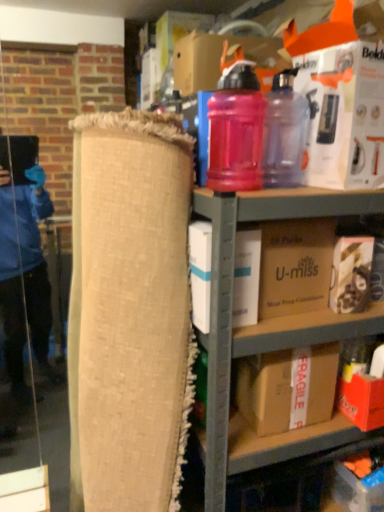
Locate an element on the screen. This screenshot has width=384, height=512. white cardboard box at upper right, the 5th box from the bottom is located at coordinates (344, 115).

Describe the element at coordinates (295, 266) in the screenshot. I see `brown cardboard box at center, which ranks as the 2th box in top-to-bottom order` at that location.

At what (x,y) coordinates should I click in order to perform the action: click on fragile cardboard box at lower right. Please return your answer as a coordinate pair (x, y). Image resolution: width=384 pixels, height=512 pixels. Looking at the image, I should click on (358, 489).

Locate an element on the screen. burlap roll at center is located at coordinates (129, 311).

This screenshot has height=512, width=384. Identify the location of fragile cardboard box at center, which ranks as the first box in bottom-to-top order. (287, 388).

The width and height of the screenshot is (384, 512). Identify the location of white cardboard box at upper right, the 5th box from the bottom. (344, 115).

Is matte plastic shelf at upper center facing away from fragile cardboard box at center, the fifth box in the top-to-bottom sequence?

Yes, matte plastic shelf at upper center is positioned with its back facing fragile cardboard box at center, the fifth box in the top-to-bottom sequence.

Is matte plastic shelf at upper center inside or outside of fragile cardboard box at center, which ranks as the first box in bottom-to-top order?

The correct answer is: outside.

Based on the photo, from a real-world perspective, is matte plastic shelf at upper center positioned over fragile cardboard box at center, which ranks as the first box in bottom-to-top order, based on gravity?

Incorrect, from a real-world perspective, matte plastic shelf at upper center is lower than fragile cardboard box at center, which ranks as the first box in bottom-to-top order.

From their relative heights in the image, would you say pink translucent bottle at upper center, placed as the second bottle when sorted from right to left, is taller or shorter than white cardboard box at center, which is the fourth box in top-to-bottom order?

In the image, pink translucent bottle at upper center, placed as the second bottle when sorted from right to left, appears to be taller than white cardboard box at center, which is the fourth box in top-to-bottom order.

Can you tell me how much pink translucent bottle at upper center, which appears as the first bottle when viewed from the left, and white cardboard box at center, acting as the second box starting from the bottom, differ in facing direction?

They differ by 3.09 degrees in their facing directions.

From the image's perspective, is pink translucent bottle at upper center, which appears as the first bottle when viewed from the left, over white cardboard box at center, acting as the second box starting from the bottom?

Yes.

Could you measure the distance between pink translucent bottle at upper center, placed as the second bottle when sorted from right to left, and white cardboard box at center, which is the fourth box in top-to-bottom order?

The distance of pink translucent bottle at upper center, placed as the second bottle when sorted from right to left, from white cardboard box at center, which is the fourth box in top-to-bottom order, is 22.53 centimeters.

Would you say fragile cardboard box at center, which ranks as the first box in bottom-to-top order, is a long distance from pink translucent water bottle at upper right, which ranks as the second bottle in left-to-right order?

They are positioned close to each other.

From a real-world perspective, is fragile cardboard box at center, the fifth box in the top-to-bottom sequence, under pink translucent water bottle at upper right, which ranks as the second bottle in left-to-right order?

Yes, from a real-world perspective, fragile cardboard box at center, the fifth box in the top-to-bottom sequence, is under pink translucent water bottle at upper right, which ranks as the second bottle in left-to-right order.

Looking at the image, does fragile cardboard box at center, which ranks as the first box in bottom-to-top order, seem bigger or smaller compared to pink translucent water bottle at upper right, which is the first bottle in right-to-left order?

Considering their sizes, fragile cardboard box at center, which ranks as the first box in bottom-to-top order, takes up more space than pink translucent water bottle at upper right, which is the first bottle in right-to-left order.

Is pink translucent water bottle at upper right, which ranks as the second bottle in left-to-right order, surrounded by fragile cardboard box at center, which ranks as the first box in bottom-to-top order?

No, pink translucent water bottle at upper right, which ranks as the second bottle in left-to-right order, is not surrounded by fragile cardboard box at center, which ranks as the first box in bottom-to-top order.

Is fragile cardboard box at lower right at the back of matte plastic shelf at upper center?

Absolutely, matte plastic shelf at upper center is directed away from fragile cardboard box at lower right.

What's the angular difference between matte plastic shelf at upper center and fragile cardboard box at lower right's facing directions?

The facing directions of matte plastic shelf at upper center and fragile cardboard box at lower right are 4.24 degrees apart.

Looking at this image, based on their sizes in the image, would you say matte plastic shelf at upper center is bigger or smaller than fragile cardboard box at lower right?

In the image, matte plastic shelf at upper center appears to be larger than fragile cardboard box at lower right.

Considering the sizes of objects brown cardboard box at center, which ranks as the 2th box in top-to-bottom order, and pink translucent water bottle at upper right, which is the first bottle in right-to-left order, in the image provided, who is smaller, brown cardboard box at center, which ranks as the 2th box in top-to-bottom order, or pink translucent water bottle at upper right, which is the first bottle in right-to-left order,?

pink translucent water bottle at upper right, which is the first bottle in right-to-left order, is smaller.

From the image's perspective, which one is positioned higher, brown cardboard box at center, which ranks as the 4th box in bottom-to-top order, or pink translucent water bottle at upper right, which is the first bottle in right-to-left order?

From the image's view, pink translucent water bottle at upper right, which is the first bottle in right-to-left order, is above.

Does brown cardboard box at center, which ranks as the 4th box in bottom-to-top order, turn towards pink translucent water bottle at upper right, which ranks as the second bottle in left-to-right order?

No, brown cardboard box at center, which ranks as the 4th box in bottom-to-top order, is not turned towards pink translucent water bottle at upper right, which ranks as the second bottle in left-to-right order.

Which is in front, point (307, 307) or point (285, 99)?

The point (285, 99) is closer.

From the image's perspective, which one is positioned higher, brown cardboard box at center, which ranks as the 4th box in bottom-to-top order, or matte brown box at lower right, which is the third box from bottom to top?

brown cardboard box at center, which ranks as the 4th box in bottom-to-top order, from the image's perspective.

Can you confirm if brown cardboard box at center, which ranks as the 2th box in top-to-bottom order, is thinner than matte brown box at lower right, acting as the third box starting from the top?

No, brown cardboard box at center, which ranks as the 2th box in top-to-bottom order, is not thinner than matte brown box at lower right, acting as the third box starting from the top.

Looking at this image, measure the distance between brown cardboard box at center, which ranks as the 2th box in top-to-bottom order, and matte brown box at lower right, acting as the third box starting from the top.

brown cardboard box at center, which ranks as the 2th box in top-to-bottom order, is 3.90 inches from matte brown box at lower right, acting as the third box starting from the top.

Are brown cardboard box at center, which ranks as the 4th box in bottom-to-top order, and matte brown box at lower right, which is the third box from bottom to top, located far from each other?

That's not correct — brown cardboard box at center, which ranks as the 4th box in bottom-to-top order, is a little close to matte brown box at lower right, which is the third box from bottom to top.

Does white cardboard box at upper right, acting as the first box starting from the top, have a greater height compared to matte brown box at lower right, which is the third box from bottom to top?

Correct, white cardboard box at upper right, acting as the first box starting from the top, is much taller as matte brown box at lower right, which is the third box from bottom to top.

What's the angular difference between white cardboard box at upper right, acting as the first box starting from the top, and matte brown box at lower right, which is the third box from bottom to top,'s facing directions?

They differ by 1.6 degrees in their facing directions.

Is matte brown box at lower right, acting as the third box starting from the top, at the back of white cardboard box at upper right, acting as the first box starting from the top?

No, matte brown box at lower right, acting as the third box starting from the top, is not at the back of white cardboard box at upper right, acting as the first box starting from the top.

Is white cardboard box at upper right, acting as the first box starting from the top, wider than matte brown box at lower right, acting as the third box starting from the top?

Yes, white cardboard box at upper right, acting as the first box starting from the top, is wider than matte brown box at lower right, acting as the third box starting from the top.

From a real-world perspective, which box is the 1st one above the matte plastic shelf at upper center? Please provide its 2D coordinates.

[(287, 388)]

The height and width of the screenshot is (512, 384). What are the coordinates of `the 1st bottle to the right of the white cardboard box at center, acting as the second box starting from the bottom, counting from the anchor's position` in the screenshot? It's located at (236, 131).

Estimate the real-world distances between objects in this image. Which object is closer to brown cardboard box at center, which ranks as the 2th box in top-to-bottom order, burlap roll at center or pink translucent water bottle at upper right, which is the first bottle in right-to-left order?

pink translucent water bottle at upper right, which is the first bottle in right-to-left order, is positioned closer to the anchor brown cardboard box at center, which ranks as the 2th box in top-to-bottom order.

Based on their spatial positions, is brown cardboard box at center, which ranks as the 4th box in bottom-to-top order, or white cardboard box at upper right, the 5th box from the bottom, further from fragile cardboard box at center, which ranks as the first box in bottom-to-top order?

The object further to fragile cardboard box at center, which ranks as the first box in bottom-to-top order, is white cardboard box at upper right, the 5th box from the bottom.

Considering their positions, is fragile cardboard box at lower right positioned further to fragile cardboard box at center, which ranks as the first box in bottom-to-top order, than white cardboard box at center, which is the fourth box in top-to-bottom order?

fragile cardboard box at lower right is positioned further to the anchor fragile cardboard box at center, which ranks as the first box in bottom-to-top order.

When comparing their distances from burlap roll at center, does white cardboard box at upper right, the 5th box from the bottom, or pink translucent bottle at upper center, which appears as the first bottle when viewed from the left, seem further?

white cardboard box at upper right, the 5th box from the bottom, is positioned further to the anchor burlap roll at center.

From the image, which object appears to be nearer to fragile cardboard box at lower right, burlap roll at center or pink translucent water bottle at upper right, which is the first bottle in right-to-left order?

Based on the image, burlap roll at center appears to be nearer to fragile cardboard box at lower right.

Looking at the image, which one is located closer to fragile cardboard box at lower right, brown cardboard box at center, which ranks as the 2th box in top-to-bottom order, or matte brown box at lower right, acting as the third box starting from the top?

Among the two, matte brown box at lower right, acting as the third box starting from the top, is located nearer to fragile cardboard box at lower right.

Considering their positions, is burlap roll at center positioned closer to white cardboard box at center, acting as the second box starting from the bottom, than fragile cardboard box at center, the fifth box in the top-to-bottom sequence?

burlap roll at center is positioned closer to the anchor white cardboard box at center, acting as the second box starting from the bottom.

Based on the photo, when comparing their distances from pink translucent water bottle at upper right, which is the first bottle in right-to-left order, does matte brown box at lower right, acting as the third box starting from the top, or matte plastic shelf at upper center seem closer?

Based on the image, matte brown box at lower right, acting as the third box starting from the top, appears to be nearer to pink translucent water bottle at upper right, which is the first bottle in right-to-left order.

Find the location of a particular element. bottle that lies between pink translucent water bottle at upper right, which is the first bottle in right-to-left order, and matte brown box at lower right, acting as the third box starting from the top, from top to bottom is located at coordinates (236, 131).

The image size is (384, 512). Find the location of `box between white cardboard box at upper right, acting as the first box starting from the top, and matte brown box at lower right, which is the third box from bottom to top, from top to bottom`. box between white cardboard box at upper right, acting as the first box starting from the top, and matte brown box at lower right, which is the third box from bottom to top, from top to bottom is located at coordinates (295, 266).

You are a GUI agent. You are given a task and a screenshot of the screen. Output one action in this format:
    pyautogui.click(x=<x>, y=<y>)
    Task: Click on the bottle between pink translucent water bottle at upper right, which is the first bottle in right-to-left order, and white cardboard box at center, which is the fourth box in top-to-bottom order, vertically
    The image size is (384, 512).
    Given the screenshot: What is the action you would take?
    pyautogui.click(x=236, y=131)

Locate an element on the screen. The height and width of the screenshot is (512, 384). bottle between pink translucent water bottle at upper right, which is the first bottle in right-to-left order, and matte plastic shelf at upper center in the up-down direction is located at coordinates (236, 131).